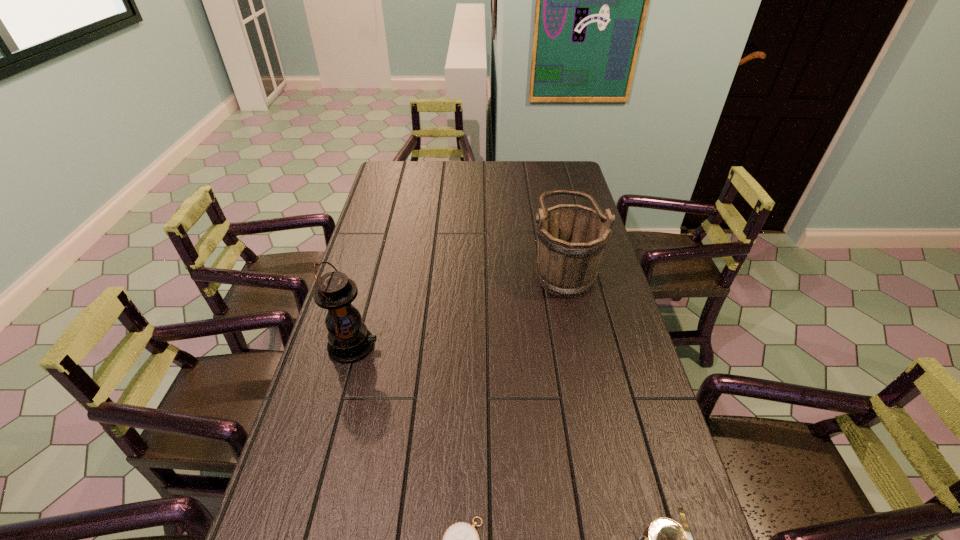
Find the location of `the leftmost object`. the leftmost object is located at coordinates pyautogui.click(x=349, y=340).

At what (x,y) coordinates should I click in order to perform the action: click on the third nearest object. Please return your answer as a coordinate pair (x, y). Looking at the image, I should click on (349, 340).

This screenshot has height=540, width=960. I want to click on the farthest object, so click(x=571, y=239).

At what (x,y) coordinates should I click in order to perform the action: click on the third shortest object. Please return your answer as a coordinate pair (x, y). This screenshot has width=960, height=540. Looking at the image, I should click on (571, 239).

Locate several points within the vacant space situated 0.080m above the leftmost object, indicating its light source. Please provide its 2D coordinates. Your answer should be formatted as a tuple, i.e. [(x, y)], where the tuple contains the x and y coordinates of a point satisfying the conditions above.

[(405, 346)]

In order to click on vacant space located on the handle side of the third shortest object in this screenshot , I will do `click(469, 267)`.

Locate an element on the screen. This screenshot has width=960, height=540. vacant space located 0.360m on the handle side of the third shortest object is located at coordinates (428, 267).

The width and height of the screenshot is (960, 540). Identify the location of vacant region located 0.370m on the handle side of the third shortest object. (425, 267).

You are a GUI agent. You are given a task and a screenshot of the screen. Output one action in this format:
    pyautogui.click(x=<x>, y=<y>)
    Task: Click on the object situated at the left edge
    
    Given the screenshot: What is the action you would take?
    pyautogui.click(x=349, y=340)

Identify the location of object at the right edge. (571, 239).